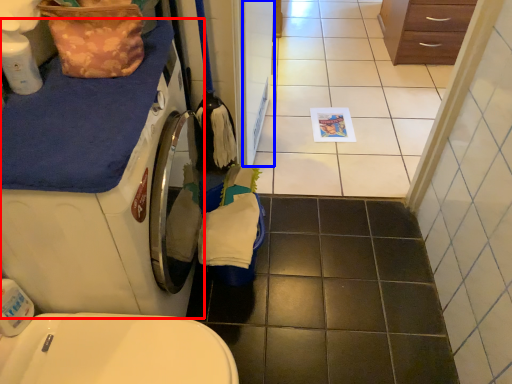
Question: Which of the following is the farthest to the observer, washing machine (highlighted by a red box) or screen door (highlighted by a blue box)?

Choices:
 (A) washing machine
 (B) screen door

Answer: (B)